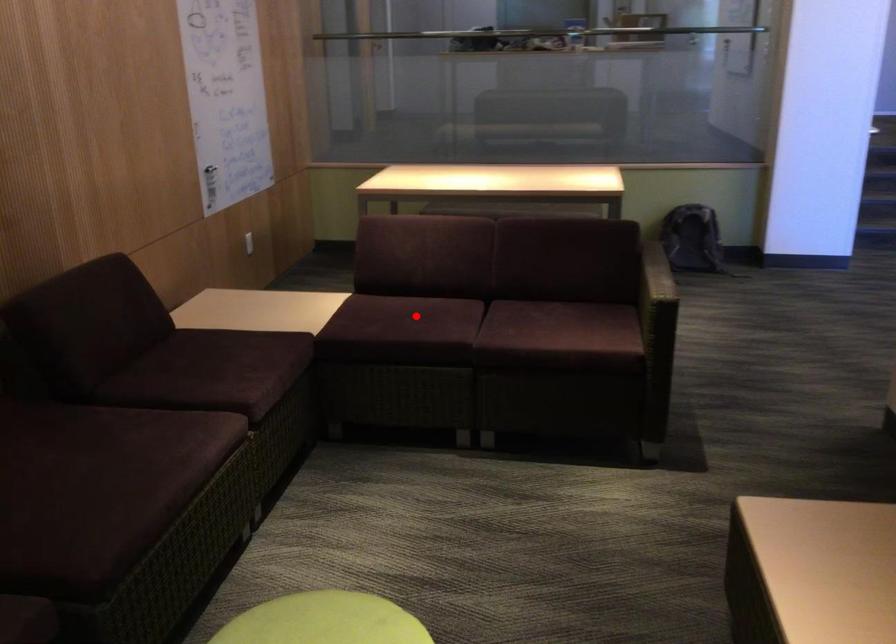
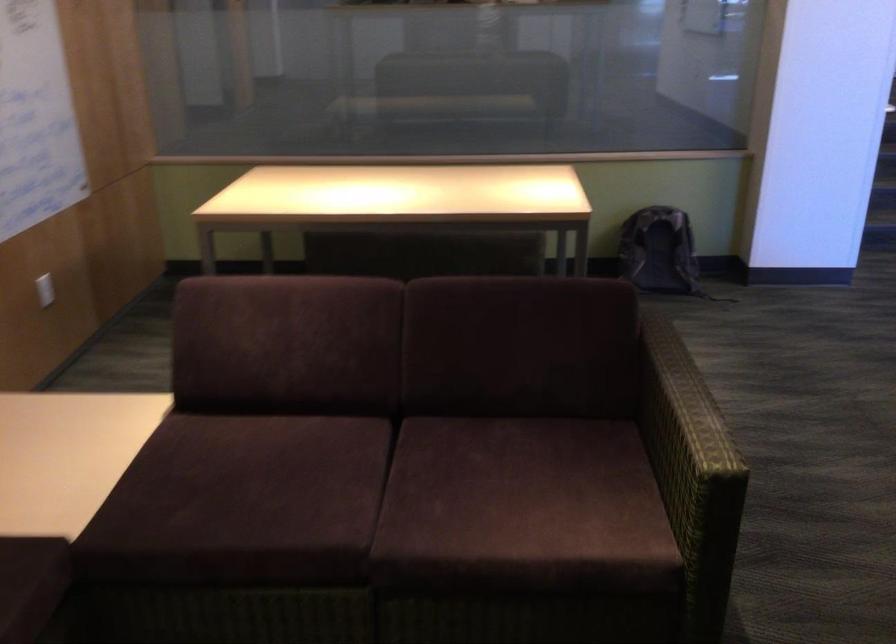
In the second image, find the point that corresponds to the highlighted location in the first image.

(269, 476)